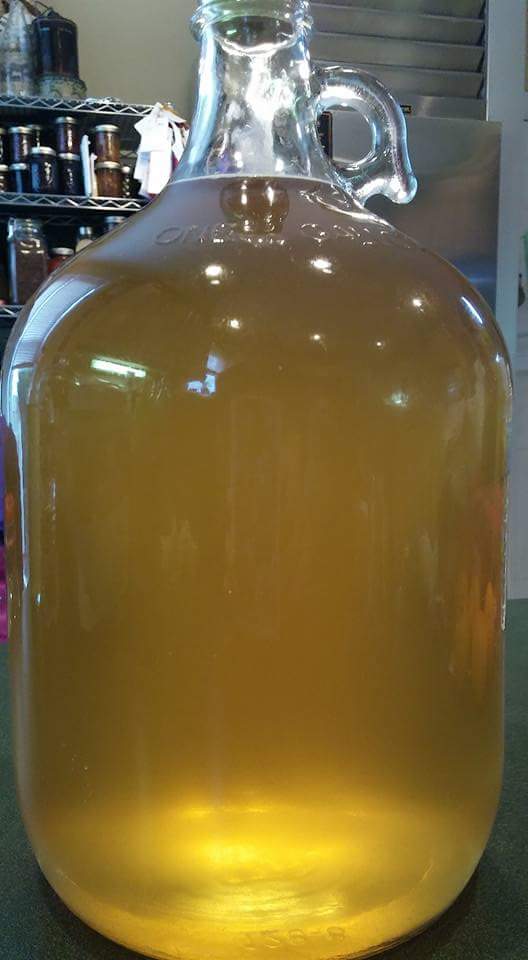
I want to click on shelves, so click(x=54, y=104), click(x=64, y=201), click(x=11, y=308).